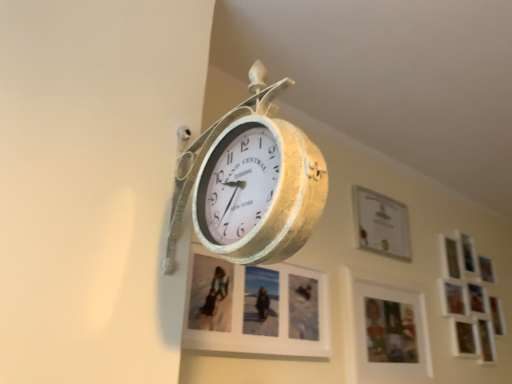
Question: Does matte white picture frame at upper center, the second picture frame viewed from the right, have a larger size compared to wooden photo frame at lower right, marked as the 3th picture frame in a right-to-left arrangement?

Choices:
 (A) no
 (B) yes

Answer: (A)

Question: Does matte white picture frame at upper center, which ranks as the 3th picture frame in left-to-right order, have a smaller size compared to wooden photo frame at lower right, which is the 2th picture frame from left to right?

Choices:
 (A) no
 (B) yes

Answer: (B)

Question: Is matte white picture frame at upper center, the second picture frame viewed from the right, shorter than wooden photo frame at lower right, which is the 2th picture frame from left to right?

Choices:
 (A) no
 (B) yes

Answer: (B)

Question: From the image's perspective, is matte white picture frame at upper center, which ranks as the 3th picture frame in left-to-right order, on wooden photo frame at lower right, marked as the 3th picture frame in a right-to-left arrangement?

Choices:
 (A) yes
 (B) no

Answer: (A)

Question: From a real-world perspective, is matte white picture frame at upper center, which ranks as the 3th picture frame in left-to-right order, located beneath wooden photo frame at lower right, marked as the 3th picture frame in a right-to-left arrangement?

Choices:
 (A) yes
 (B) no

Answer: (B)

Question: Can you confirm if matte white picture frame at upper center, the second picture frame viewed from the right, is positioned to the right of wooden photo frame at lower right, which is the 2th picture frame from left to right?

Choices:
 (A) no
 (B) yes

Answer: (B)

Question: Can you see white matte picture frame at upper right, arranged as the fourth picture frame when viewed from the left, touching matte white picture frame at upper center, the second picture frame viewed from the right?

Choices:
 (A) yes
 (B) no

Answer: (B)

Question: From a real-world perspective, is white matte picture frame at upper right, arranged as the fourth picture frame when viewed from the left, on top of matte white picture frame at upper center, which ranks as the 3th picture frame in left-to-right order?

Choices:
 (A) yes
 (B) no

Answer: (B)

Question: Is white matte picture frame at upper right, arranged as the fourth picture frame when viewed from the left, far away from matte white picture frame at upper center, the second picture frame viewed from the right?

Choices:
 (A) no
 (B) yes

Answer: (A)

Question: Is white matte picture frame at upper right, the first picture frame when ordered from right to left, to the right of matte white picture frame at upper center, which ranks as the 3th picture frame in left-to-right order, from the viewer's perspective?

Choices:
 (A) no
 (B) yes

Answer: (B)

Question: Is white matte picture frame at upper right, arranged as the fourth picture frame when viewed from the left, facing away from matte white picture frame at upper center, the second picture frame viewed from the right?

Choices:
 (A) yes
 (B) no

Answer: (B)

Question: Is white matte picture frame at upper right, arranged as the fourth picture frame when viewed from the left, further to the viewer compared to matte white picture frame at upper center, the second picture frame viewed from the right?

Choices:
 (A) yes
 (B) no

Answer: (A)

Question: Is wooden photo frame at lower right, marked as the 3th picture frame in a right-to-left arrangement, placed right next to matte white picture frame at center, the 1th picture frame viewed from the left?

Choices:
 (A) no
 (B) yes

Answer: (A)